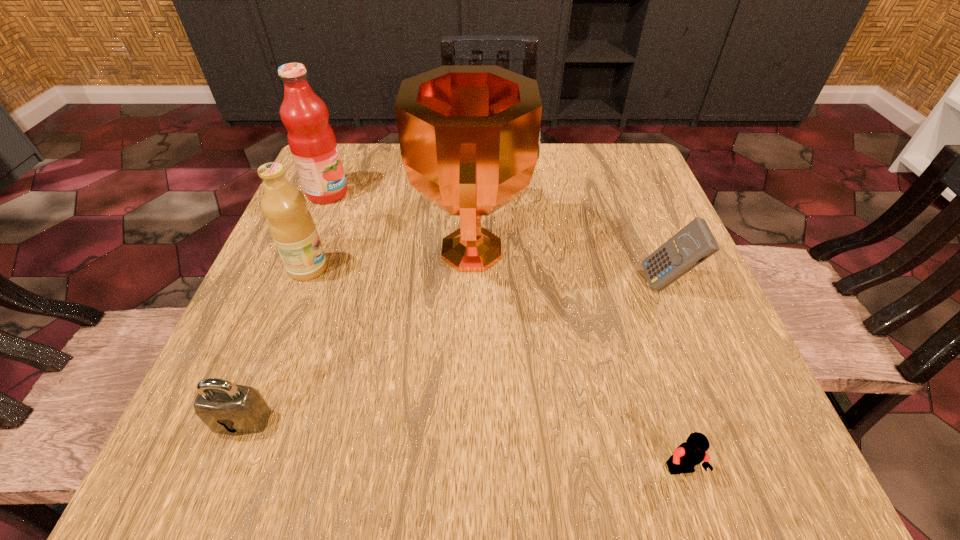
Find the location of a particular element. vacant space located 0.240m on the front label of the fruit juice is located at coordinates (452, 193).

Image resolution: width=960 pixels, height=540 pixels. Identify the location of vacant point located 0.210m on the label of the fourth shortest object. (438, 268).

Find the location of `free space located 0.270m on the front-facing side of the fourth tallest object`. free space located 0.270m on the front-facing side of the fourth tallest object is located at coordinates (498, 284).

Locate an element on the screen. The height and width of the screenshot is (540, 960). vacant space located 0.210m on the front-facing side of the fourth tallest object is located at coordinates (531, 284).

The image size is (960, 540). Identify the location of free spot located on the front-facing side of the fourth tallest object. (471, 284).

Where is `object that is positioned at the far edge`? object that is positioned at the far edge is located at coordinates (311, 139).

Where is `padlock at the near edge`? The image size is (960, 540). padlock at the near edge is located at coordinates (226, 408).

Find the location of a particular element. The image size is (960, 540). Lego that is positioned at the near edge is located at coordinates (686, 456).

I want to click on fruit juice that is at the left edge, so click(x=311, y=139).

Image resolution: width=960 pixels, height=540 pixels. What are the coordinates of `olive oil positioned at the left edge` in the screenshot? It's located at (291, 225).